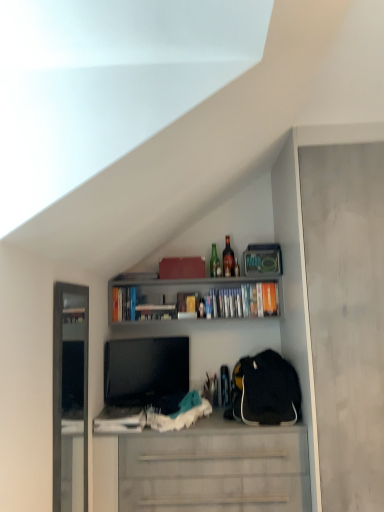
Question: Is hardcover books at upper center, placed as the 1th book when sorted from right to left, located outside matte gray cabinet at right?

Choices:
 (A) yes
 (B) no

Answer: (A)

Question: Is hardcover books at upper center, arranged as the third book when viewed from the left, taller than matte gray cabinet at right?

Choices:
 (A) no
 (B) yes

Answer: (A)

Question: Is the position of hardcover books at upper center, placed as the 1th book when sorted from right to left, less distant than that of matte gray cabinet at right?

Choices:
 (A) no
 (B) yes

Answer: (A)

Question: Does hardcover books at upper center, arranged as the third book when viewed from the left, have a lesser width compared to matte gray cabinet at right?

Choices:
 (A) yes
 (B) no

Answer: (A)

Question: Is hardcover books at upper center, placed as the 1th book when sorted from right to left, further to camera compared to matte gray cabinet at right?

Choices:
 (A) yes
 (B) no

Answer: (A)

Question: Could you tell me if hardcover books at upper center, placed as the 1th book when sorted from right to left, is turned towards matte gray cabinet at right?

Choices:
 (A) yes
 (B) no

Answer: (B)

Question: From the image's perspective, does black fabric backpack at right appear lower than matte cardboard book at upper center, which appears as the second book when viewed from the right?

Choices:
 (A) yes
 (B) no

Answer: (A)

Question: From a real-world perspective, is black fabric backpack at right physically below matte cardboard book at upper center, the 2th book positioned from the left?

Choices:
 (A) no
 (B) yes

Answer: (B)

Question: Considering the relative sizes of black fabric backpack at right and matte cardboard book at upper center, the 2th book positioned from the left, in the image provided, is black fabric backpack at right wider than matte cardboard book at upper center, the 2th book positioned from the left,?

Choices:
 (A) yes
 (B) no

Answer: (A)

Question: Would you say black fabric backpack at right is outside matte cardboard book at upper center, which appears as the second book when viewed from the right?

Choices:
 (A) no
 (B) yes

Answer: (B)

Question: Is black fabric backpack at right facing away from matte cardboard book at upper center, the 2th book positioned from the left?

Choices:
 (A) yes
 (B) no

Answer: (B)

Question: Is the depth of black fabric backpack at right greater than that of matte cardboard book at upper center, the 2th book positioned from the left?

Choices:
 (A) no
 (B) yes

Answer: (A)

Question: From a real-world perspective, is matte cardboard book at upper center, the 2th book positioned from the left, located higher than matte gray cabinet at right?

Choices:
 (A) no
 (B) yes

Answer: (B)